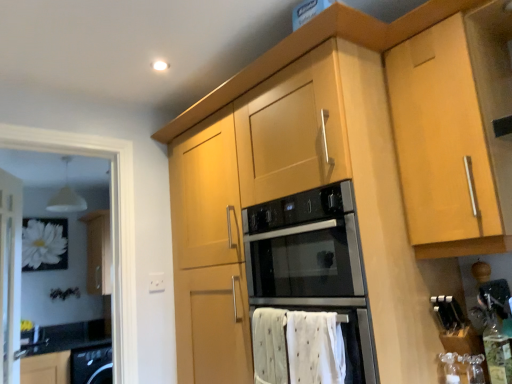
What is the approximate width of white glossy sink at lower left?

The width of white glossy sink at lower left is 6.61 inches.

The width and height of the screenshot is (512, 384). Describe the element at coordinates (156, 282) in the screenshot. I see `white plastic electric outlet at lower center` at that location.

Identify the location of white cotton bath towel at lower center. The image size is (512, 384). (297, 347).

Is the depth of white glossy sink at lower left less than that of white plastic electric outlet at lower center?

No, the depth of white glossy sink at lower left is greater than that of white plastic electric outlet at lower center.

Looking at this image, could you tell me if white glossy sink at lower left is turned towards white plastic electric outlet at lower center?

Yes, white glossy sink at lower left is oriented towards white plastic electric outlet at lower center.

Measure the distance between white glossy sink at lower left and white plastic electric outlet at lower center.

2.22 meters.

Between white glossy sink at lower left and white plastic electric outlet at lower center, which one has smaller size?

white plastic electric outlet at lower center.

From the image's perspective, does white glossy sink at lower left appear lower than white glossy screen door at left?

Yes.

Between white glossy sink at lower left and white glossy screen door at left, which one has larger size?

Bigger between the two is white glossy screen door at left.

Are white glossy sink at lower left and white glossy screen door at left beside each other?

No, white glossy sink at lower left is not beside white glossy screen door at left.

Is point (300, 383) behind point (160, 288)?

No, it is in front of (160, 288).

Is white cotton bath towel at lower center shorter than white plastic electric outlet at lower center?

Incorrect, the height of white cotton bath towel at lower center does not fall short of that of white plastic electric outlet at lower center.

From a real-world perspective, is white cotton bath towel at lower center positioned above or below white plastic electric outlet at lower center?

Clearly, from a real-world perspective, white cotton bath towel at lower center is below white plastic electric outlet at lower center.

Is white cotton bath towel at lower center surrounded by white plastic electric outlet at lower center?

Definitely not — white cotton bath towel at lower center is not inside white plastic electric outlet at lower center.

Does white plastic electric outlet at lower center lie in front of white cotton bath towel at lower center?

No, it is not.

From a real-world perspective, is white plastic electric outlet at lower center on white cotton bath towel at lower center?

Indeed, from a real-world perspective, white plastic electric outlet at lower center stands above white cotton bath towel at lower center.

From a real-world perspective, is white glossy screen door at left under white plastic electric outlet at lower center?

Incorrect, from a real-world perspective, white glossy screen door at left is higher than white plastic electric outlet at lower center.

Is white glossy screen door at left next to white plastic electric outlet at lower center?

No, white glossy screen door at left is not in contact with white plastic electric outlet at lower center.

The width and height of the screenshot is (512, 384). I want to click on electric outlet lying below the white glossy screen door at left (from the image's perspective), so click(156, 282).

Does white glossy screen door at left turn towards white plastic electric outlet at lower center?

Yes, white glossy screen door at left is oriented towards white plastic electric outlet at lower center.

Which object is positioned more to the right, white plastic electric outlet at lower center or white glossy screen door at left?

white plastic electric outlet at lower center.

Between point (153, 281) and point (2, 189), which one is positioned in front?

Point (153, 281)

From the image's perspective, relative to white glossy screen door at left, is white plastic electric outlet at lower center above or below?

white plastic electric outlet at lower center is situated lower than white glossy screen door at left in the image.

Which object is more forward, white plastic electric outlet at lower center or white glossy screen door at left?

white glossy screen door at left is in front.

From the image's perspective, is white glossy screen door at left below white cotton bath towel at lower center?

No, from the image's perspective, white glossy screen door at left is not below white cotton bath towel at lower center.

Is white glossy screen door at left oriented away from white cotton bath towel at lower center?

white glossy screen door at left does not have its back to white cotton bath towel at lower center.

Is white glossy screen door at left positioned before white cotton bath towel at lower center?

No.

Are white glossy screen door at left and white cotton bath towel at lower center located far from each other?

Yes.

You are a GUI agent. You are given a task and a screenshot of the screen. Output one action in this format:
    pyautogui.click(x=<x>, y=<y>)
    Task: Click on the sink below the white plastic electric outlet at lower center (from a real-world perspective)
    
    Given the screenshot: What is the action you would take?
    pyautogui.click(x=33, y=339)

There is a white glossy sink at lower left. Identify the location of screen door above it (from a real-world perspective). (10, 275).

When comparing their distances from white glossy sink at lower left, does white glossy screen door at left or light wood cabinet at center seem further?

The object further to white glossy sink at lower left is light wood cabinet at center.

When comparing their distances from white glossy sink at lower left, does white cotton bath towel at lower center or white plastic electric outlet at lower center seem closer?

white plastic electric outlet at lower center lies closer to white glossy sink at lower left than the other object.

From the image, which object appears to be nearer to white cotton bath towel at lower center, white glossy screen door at left or light wood cabinet at center?

Based on the image, light wood cabinet at center appears to be nearer to white cotton bath towel at lower center.

Based on their spatial positions, is light wood cabinet at center or white glossy screen door at left closer to white plastic electric outlet at lower center?

white glossy screen door at left is closer to white plastic electric outlet at lower center.

When comparing their distances from white cotton bath towel at lower center, does light wood cabinet at center or white glossy screen door at left seem closer?

Among the two, light wood cabinet at center is located nearer to white cotton bath towel at lower center.

Looking at the image, which one is located further to white glossy sink at lower left, white cotton bath towel at lower center or white glossy screen door at left?

Based on the image, white cotton bath towel at lower center appears to be further to white glossy sink at lower left.

Estimate the real-world distances between objects in this image. Which object is closer to light wood cabinet at center, white glossy sink at lower left or white plastic electric outlet at lower center?

The object closer to light wood cabinet at center is white plastic electric outlet at lower center.

When comparing their distances from light wood cabinet at center, does white glossy screen door at left or white cotton bath towel at lower center seem further?

white glossy screen door at left.

You are a GUI agent. You are given a task and a screenshot of the screen. Output one action in this format:
    pyautogui.click(x=<x>, y=<y>)
    Task: Click on the bath towel between light wood cabinet at center and white plastic electric outlet at lower center from front to back
    Image resolution: width=512 pixels, height=384 pixels.
    Given the screenshot: What is the action you would take?
    pyautogui.click(x=297, y=347)

Identify the location of electric outlet between white glossy screen door at left and white glossy sink at lower left in the front-back direction. The height and width of the screenshot is (384, 512). (156, 282).

Locate an element on the screen. The height and width of the screenshot is (384, 512). bath towel located between light wood cabinet at center and white glossy sink at lower left in the depth direction is located at coordinates (297, 347).

You are a GUI agent. You are given a task and a screenshot of the screen. Output one action in this format:
    pyautogui.click(x=<x>, y=<y>)
    Task: Click on the electric outlet located between white cotton bath towel at lower center and white glossy sink at lower left in the depth direction
    The width and height of the screenshot is (512, 384).
    Given the screenshot: What is the action you would take?
    pyautogui.click(x=156, y=282)